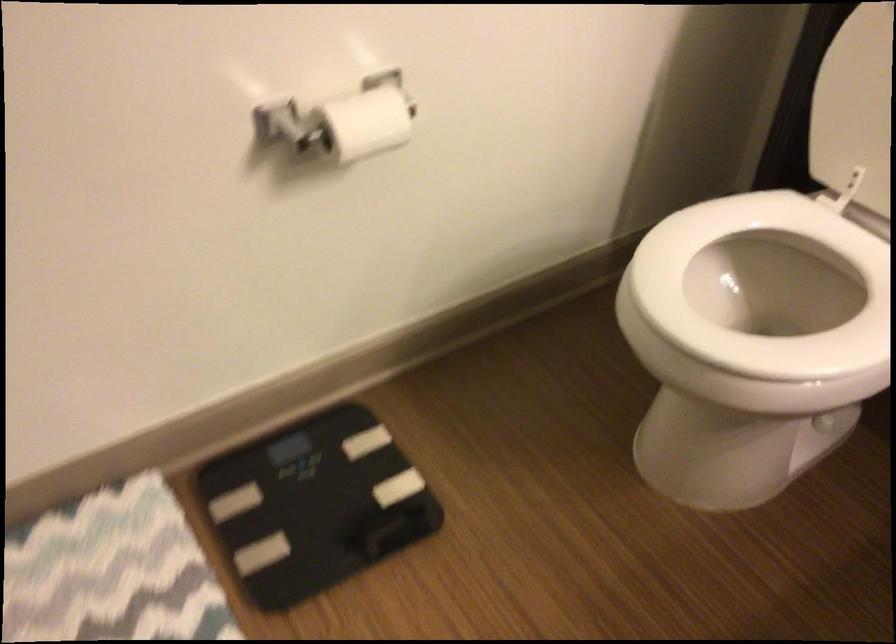
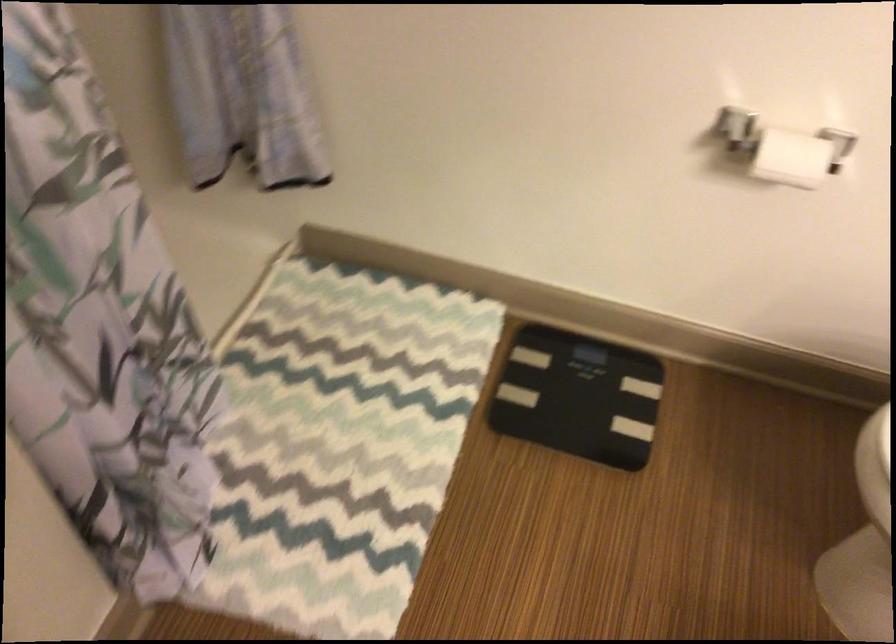
Question: The first image is from the beginning of the video and the second image is from the end. How did the camera likely rotate when shooting the video?

Choices:
 (A) Left
 (B) Right
 (C) Up
 (D) Down

Answer: (A)